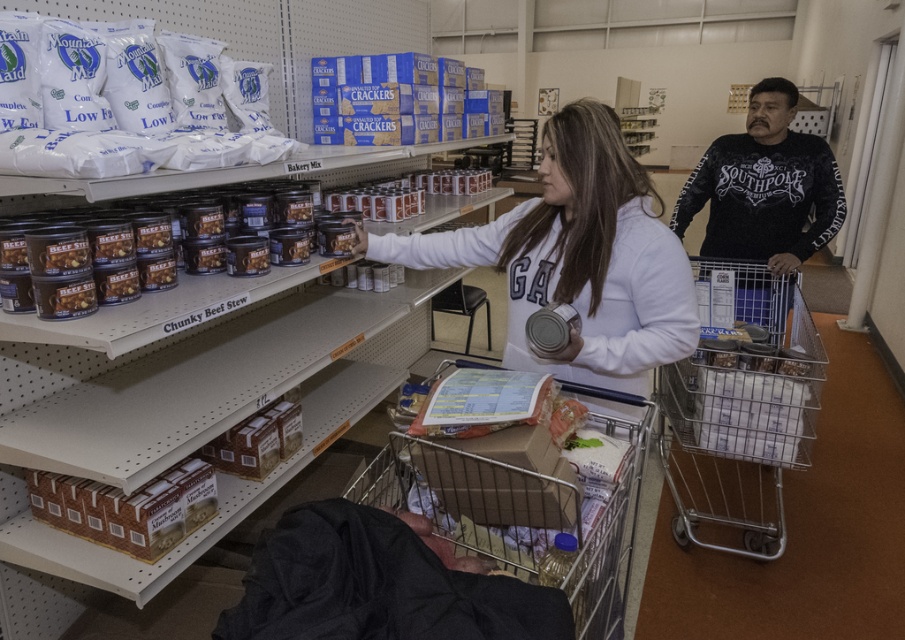
Question: Where is white matte sweatshirt at center located in relation to silver metal shopping cart at lower right in the image?

Choices:
 (A) right
 (B) left

Answer: (B)

Question: Is silver metal shopping cart at lower right behind metallic silver shopping cart at lower center?

Choices:
 (A) yes
 (B) no

Answer: (A)

Question: Can you confirm if silver metal shopping cart at lower right is thinner than black long-sleeve shirt at right?

Choices:
 (A) yes
 (B) no

Answer: (A)

Question: Which point is closer to the camera taking this photo?

Choices:
 (A) (705, 465)
 (B) (811, 136)

Answer: (B)

Question: Which point appears farthest from the camera in this image?

Choices:
 (A) (655, 268)
 (B) (793, 371)
 (C) (405, 436)
 (D) (763, 97)

Answer: (D)

Question: Among these points, which one is farthest from the camera?

Choices:
 (A) (570, 163)
 (B) (822, 176)
 (C) (497, 476)

Answer: (B)